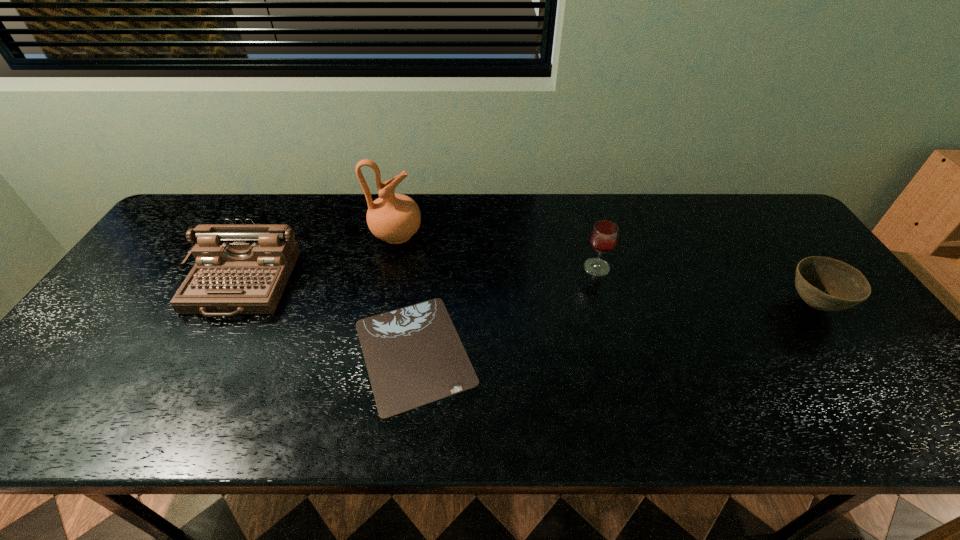
Locate an element on the screen. The width and height of the screenshot is (960, 540). the tallest object is located at coordinates (395, 218).

The image size is (960, 540). What are the coordinates of `wineglass` in the screenshot? It's located at (604, 235).

Identify the location of typewriter. (240, 269).

Identify the location of the fourth tallest object. (827, 284).

The width and height of the screenshot is (960, 540). Identify the location of bowl. (827, 284).

I want to click on the shortest object, so click(x=414, y=356).

The image size is (960, 540). In order to click on vacant space situated 0.080m on the spout of the tallest object in this screenshot , I will do `click(448, 235)`.

Identify the location of vacant space situated on the right of the wineglass. This screenshot has width=960, height=540. (659, 267).

In order to click on free space located on the keyboard of the leftmost object in this screenshot , I will do `click(175, 409)`.

Find the location of a particular element. This screenshot has width=960, height=540. free region located 0.390m on the back of the rightmost object is located at coordinates (739, 200).